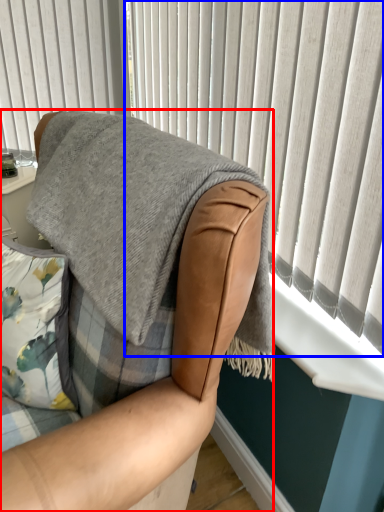
Question: Which of the following is the farthest to the observer, chair (highlighted by a red box) or curtain (highlighted by a blue box)?

Choices:
 (A) chair
 (B) curtain

Answer: (B)